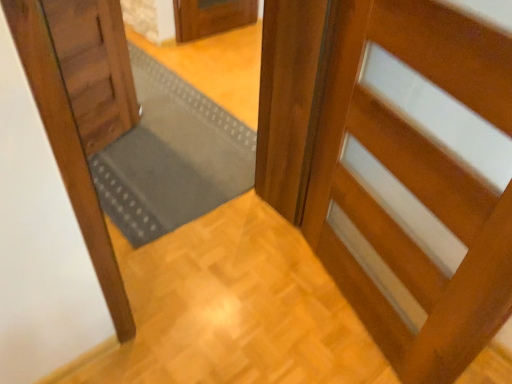
Question: From the image's perspective, is glossy wood door at right, the first door positioned from the right, positioned above or below wooden door at left, positioned as the second door in right-to-left order?

Choices:
 (A) above
 (B) below

Answer: (B)

Question: In the image, is glossy wood door at right, positioned as the 2th door in left-to-right order, on the left side or the right side of wooden door at left, placed as the 1th door when sorted from left to right?

Choices:
 (A) right
 (B) left

Answer: (A)

Question: Which of these objects is positioned closest to the wooden door at left, positioned as the second door in right-to-left order?

Choices:
 (A) gray rubber doormat at center
 (B) wooden staircase at lower right
 (C) glossy wood door at right, the first door positioned from the right

Answer: (A)

Question: Considering the real-world distances, which object is farthest from the gray rubber doormat at center?

Choices:
 (A) wooden staircase at lower right
 (B) wooden door at left, placed as the 1th door when sorted from left to right
 (C) glossy wood door at right, the first door positioned from the right

Answer: (C)